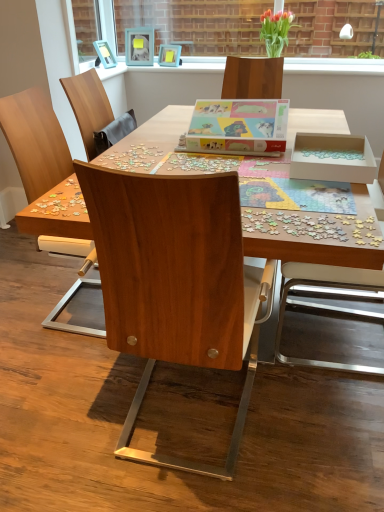
I want to click on pastel matte puzzle box at center, so click(x=237, y=127).

The image size is (384, 512). In order to click on wooden chair at center, the first chair from the right in this screenshot , I will do `click(328, 306)`.

What do you see at coordinates (196, 24) in the screenshot?
I see `clear glass vase at upper center` at bounding box center [196, 24].

The width and height of the screenshot is (384, 512). I want to click on pastel matte puzzle box at center, so click(237, 127).

Does teal matte picture frame at upper center, which is the 2th picture frame from right to left, have a larger size compared to wooden chair at center, the second chair in the left-to-right sequence?

No, teal matte picture frame at upper center, which is the 2th picture frame from right to left, is not bigger than wooden chair at center, the second chair in the left-to-right sequence.

How different are the orientations of teal matte picture frame at upper center, the 1th picture frame viewed from the left, and wooden chair at center, the second chair positioned from the right, in degrees?

They differ by 170 degrees in their facing directions.

Would you say teal matte picture frame at upper center, which is the 2th picture frame from right to left, is outside wooden chair at center, the second chair in the left-to-right sequence?

Absolutely, teal matte picture frame at upper center, which is the 2th picture frame from right to left, is external to wooden chair at center, the second chair in the left-to-right sequence.

Between point (126, 38) and point (199, 196), which one is positioned in front?

Positioned in front is point (199, 196).

Considering the relative sizes of clear glass vase at upper center and teal matte picture frame at upper center, the 1th picture frame viewed from the left, in the image provided, is clear glass vase at upper center wider than teal matte picture frame at upper center, the 1th picture frame viewed from the left,?

No.

Considering the relative positions of clear glass vase at upper center and teal matte picture frame at upper center, which is the 2th picture frame from right to left, in the image provided, is clear glass vase at upper center to the left of teal matte picture frame at upper center, which is the 2th picture frame from right to left, from the viewer's perspective?

In fact, clear glass vase at upper center is to the right of teal matte picture frame at upper center, which is the 2th picture frame from right to left.

Between clear glass vase at upper center and teal matte picture frame at upper center, the 1th picture frame viewed from the left, which one has less height?

Standing shorter between the two is teal matte picture frame at upper center, the 1th picture frame viewed from the left.

From a real-world perspective, is clear glass vase at upper center on teal matte picture frame at upper center, which is the 2th picture frame from right to left?

Indeed, from a real-world perspective, clear glass vase at upper center stands above teal matte picture frame at upper center, which is the 2th picture frame from right to left.

Considering the sizes of wooden chair at center, the first chair from the right, and matte glass vase at upper center in the image, is wooden chair at center, the first chair from the right, wider or thinner than matte glass vase at upper center?

Clearly, wooden chair at center, the first chair from the right, has more width compared to matte glass vase at upper center.

Considering the relative sizes of wooden chair at center, the first chair from the right, and matte glass vase at upper center in the image provided, is wooden chair at center, the first chair from the right, smaller than matte glass vase at upper center?

No.

Who is shorter, wooden chair at center, which is the third chair from left to right, or matte glass vase at upper center?

With less height is matte glass vase at upper center.

In the scene shown: Is wooden chair at center, the second chair in the left-to-right sequence, wider than wooden chair at center, the first chair from the right?

Yes, wooden chair at center, the second chair in the left-to-right sequence, is wider than wooden chair at center, the first chair from the right.

Is the position of wooden chair at center, the second chair positioned from the right, more distant than that of wooden chair at center, the first chair from the right?

No, wooden chair at center, the second chair positioned from the right, is closer to the viewer.

Where is `chair that is the 1st object to the left of the wooden chair at center, the first chair from the right, starting at the anchor`? Image resolution: width=384 pixels, height=512 pixels. chair that is the 1st object to the left of the wooden chair at center, the first chair from the right, starting at the anchor is located at coordinates (176, 283).

Considering their positions, is matte glass vase at upper center located in front of or behind wooden chair at center, the first chair from the right?

matte glass vase at upper center is positioned farther from the viewer than wooden chair at center, the first chair from the right.

Is matte glass vase at upper center looking in the opposite direction of wooden chair at center, the first chair from the right?

matte glass vase at upper center does not have its back to wooden chair at center, the first chair from the right.

From a real-world perspective, is matte glass vase at upper center physically located above or below wooden chair at center, the first chair from the right?

Clearly, from a real-world perspective, matte glass vase at upper center is above wooden chair at center, the first chair from the right.

Find the location of a particular element. the 1st picture frame positioned above the wooden chair at center, placed as the third chair when sorted from right to left (from the image's perspective) is located at coordinates (169, 55).

Does wooden chair at center, placed as the third chair when sorted from right to left, appear on the right side of matte blue picture frame at upper center, the second picture frame viewed from the left?

Incorrect, wooden chair at center, placed as the third chair when sorted from right to left, is not on the right side of matte blue picture frame at upper center, the second picture frame viewed from the left.

Considering their positions, is wooden chair at center, placed as the third chair when sorted from right to left, located in front of or behind matte blue picture frame at upper center, marked as the 1th picture frame in a right-to-left arrangement?

In the image, wooden chair at center, placed as the third chair when sorted from right to left, appears in front of matte blue picture frame at upper center, marked as the 1th picture frame in a right-to-left arrangement.

Is wooden chair at center, marked as the 1th chair in a left-to-right arrangement, not inside white cardboard box at center?

Yes, wooden chair at center, marked as the 1th chair in a left-to-right arrangement, is outside of white cardboard box at center.

Which is in front, wooden chair at center, marked as the 1th chair in a left-to-right arrangement, or white cardboard box at center?

wooden chair at center, marked as the 1th chair in a left-to-right arrangement, is in front.

From the image's perspective, which one is positioned higher, wooden chair at center, placed as the third chair when sorted from right to left, or white cardboard box at center?

white cardboard box at center is shown above in the image.

The height and width of the screenshot is (512, 384). In order to click on chair that is the 1st object to the right of the teal matte picture frame at upper center, which is the 2th picture frame from right to left, starting at the anchor in this screenshot , I will do `click(176, 283)`.

Where is `window screen above the teal matte picture frame at upper center, the 1th picture frame viewed from the left (from the image's perspective)`? window screen above the teal matte picture frame at upper center, the 1th picture frame viewed from the left (from the image's perspective) is located at coordinates (196, 24).

From the picture: Considering their positions, is wooden chair at center, which is the third chair from left to right, positioned closer to matte blue picture frame at upper center, marked as the 1th picture frame in a right-to-left arrangement, than wooden chair at center, the second chair positioned from the right?

wooden chair at center, which is the third chair from left to right, is closer to matte blue picture frame at upper center, marked as the 1th picture frame in a right-to-left arrangement.

From the image, which object appears to be farther from matte blue picture frame at upper center, marked as the 1th picture frame in a right-to-left arrangement, teal matte picture frame at upper center, the 1th picture frame viewed from the left, or wooden chair at center, the first chair from the right?

wooden chair at center, the first chair from the right, lies further to matte blue picture frame at upper center, marked as the 1th picture frame in a right-to-left arrangement, than the other object.

Looking at the image, which one is located closer to matte blue picture frame at upper center, marked as the 1th picture frame in a right-to-left arrangement, wooden chair at center, placed as the third chair when sorted from right to left, or wooden desk at center?

Based on the image, wooden desk at center appears to be nearer to matte blue picture frame at upper center, marked as the 1th picture frame in a right-to-left arrangement.

Looking at the image, which one is located closer to wooden chair at center, which is the third chair from left to right, wooden chair at center, marked as the 1th chair in a left-to-right arrangement, or wooden desk at center?

Among the two, wooden desk at center is located nearer to wooden chair at center, which is the third chair from left to right.

Consider the image. Estimate the real-world distances between objects in this image. Which object is closer to wooden desk at center, matte glass vase at upper center or clear glass vase at upper center?

matte glass vase at upper center.

Estimate the real-world distances between objects in this image. Which object is further from wooden chair at center, placed as the third chair when sorted from right to left, wooden chair at center, the second chair positioned from the right, or matte blue picture frame at upper center, marked as the 1th picture frame in a right-to-left arrangement?

matte blue picture frame at upper center, marked as the 1th picture frame in a right-to-left arrangement, lies further to wooden chair at center, placed as the third chair when sorted from right to left, than the other object.

From the image, which object appears to be nearer to wooden desk at center, matte glass vase at upper center or wooden chair at center, the first chair from the right?

wooden chair at center, the first chair from the right, is closer to wooden desk at center.

Consider the image. When comparing their distances from wooden desk at center, does teal matte picture frame at upper center, which is the 2th picture frame from right to left, or pastel matte puzzle box at center seem further?

teal matte picture frame at upper center, which is the 2th picture frame from right to left, is further to wooden desk at center.

Locate an element on the screen. picture frame between teal matte picture frame at upper center, the 1th picture frame viewed from the left, and clear glass vase at upper center, in the horizontal direction is located at coordinates (169, 55).

Find the location of a particular element. The image size is (384, 512). houseplant between white cardboard box at center and clear glass vase at upper center in the front-back direction is located at coordinates (276, 30).

Locate an element on the screen. Image resolution: width=384 pixels, height=512 pixels. cardboard box positioned between wooden desk at center and clear glass vase at upper center from near to far is located at coordinates (237, 127).

Where is `cardboard box between wooden chair at center, placed as the third chair when sorted from right to left, and clear glass vase at upper center from front to back`? The width and height of the screenshot is (384, 512). cardboard box between wooden chair at center, placed as the third chair when sorted from right to left, and clear glass vase at upper center from front to back is located at coordinates (237, 127).